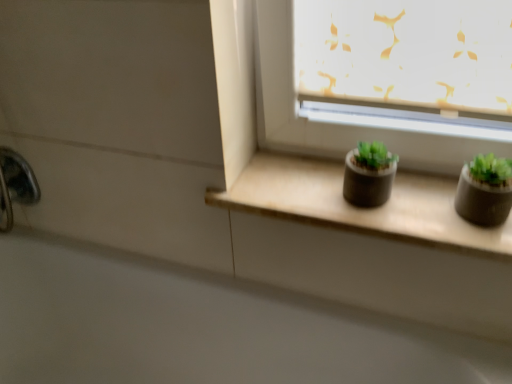
Locate an element on the screen. Image resolution: width=512 pixels, height=384 pixels. free space that is to the left of matte black pot at center, the 1th flowerpot viewed from the left is located at coordinates (298, 188).